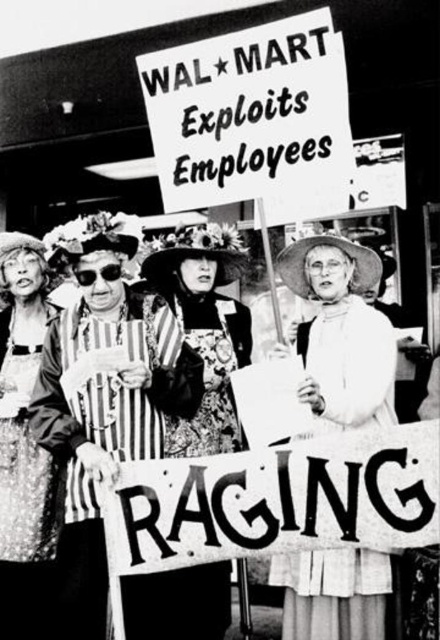
Which is behind, point (33, 294) or point (106, 273)?

The point (33, 294) is more distant.

Between point (40, 344) and point (79, 276), which one is positioned in front?

Point (79, 276) is more forward.

Locate an element on the screen. shiny sequined dress at left is located at coordinates (24, 444).

This screenshot has height=640, width=440. Identify the location of striped fabric dress at center. (103, 401).

Does striped fabric dress at center have a lesser width compared to shiny sequined dress at left?

No.

This screenshot has width=440, height=640. In order to click on striped fabric dress at center in this screenshot , I will do `click(103, 401)`.

Between striped fabric dress at center and metallic reflective goggles at center, which one has less height?

With less height is metallic reflective goggles at center.

Which of these two, striped fabric dress at center or metallic reflective goggles at center, stands taller?

striped fabric dress at center

Where is `striped fabric dress at center`? Image resolution: width=440 pixels, height=640 pixels. striped fabric dress at center is located at coordinates (103, 401).

I want to click on striped fabric dress at center, so click(x=103, y=401).